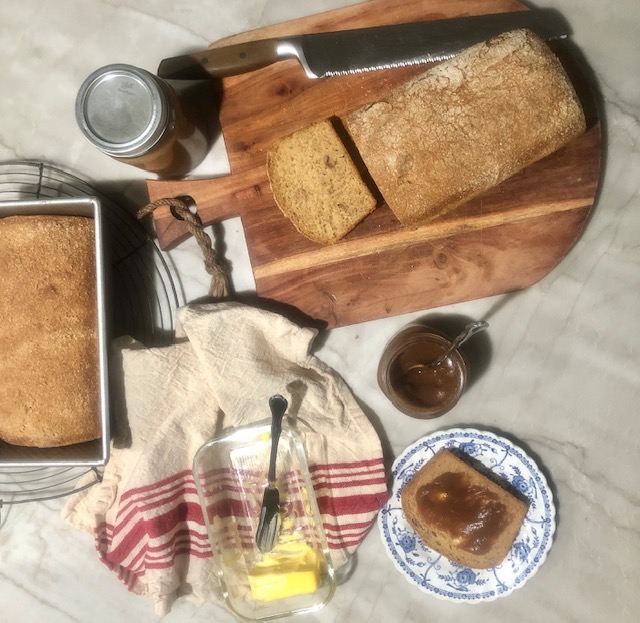
Find the location of a particular element. The height and width of the screenshot is (623, 640). towel is located at coordinates (257, 359).